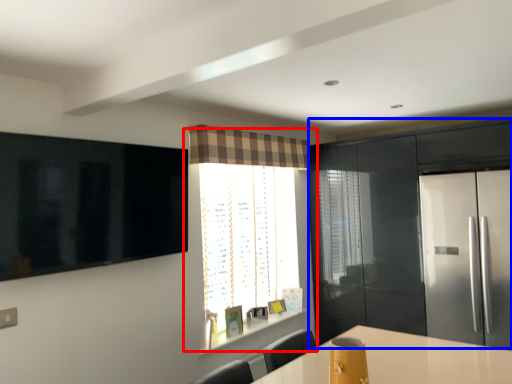
Question: Which point is further to the camera, window (highlighted by a red box) or cabinetry (highlighted by a blue box)?

Choices:
 (A) window
 (B) cabinetry

Answer: (A)